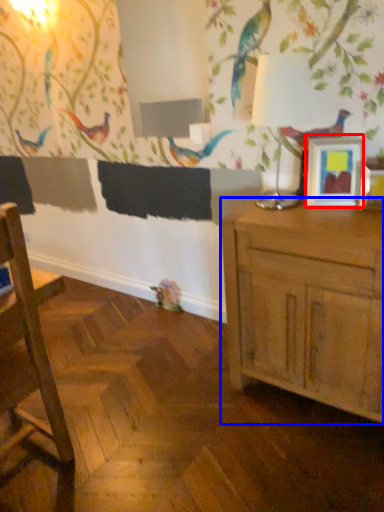
Question: Among these objects, which one is nearest to the camera, picture frame (highlighted by a red box) or cabinetry (highlighted by a blue box)?

Choices:
 (A) picture frame
 (B) cabinetry

Answer: (B)